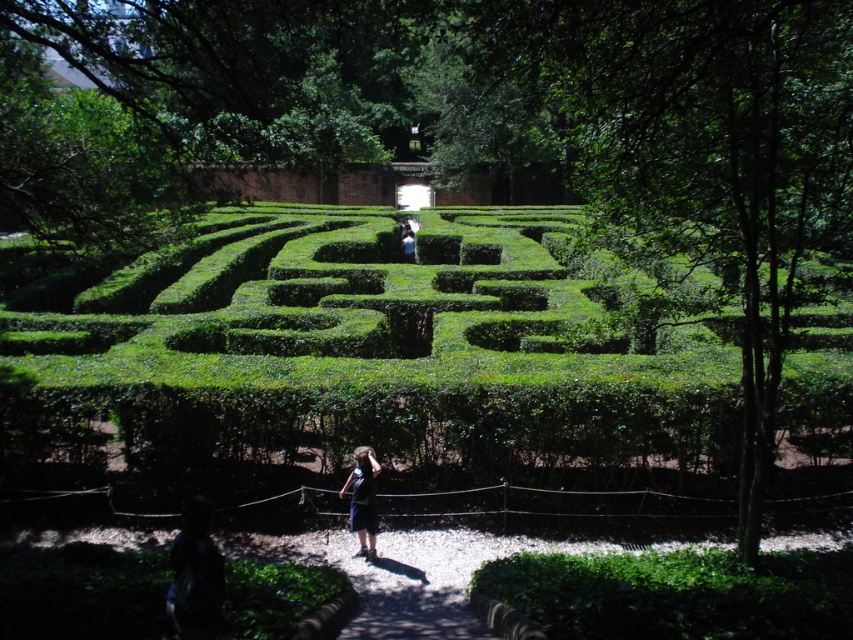
You are a visitor standing at the entrance of the hedge maze and see the dark blue shorts at lower center and the dark blue shirt at center. Which of the two items is positioned higher up in the image?

The dark blue shorts at lower center is much taller than the dark blue shirt at center, so the dark blue shorts at lower center is positioned higher up in the image.

You are standing at the entrance of the hedge maze and see a person wearing dark blue shirt at lower left and dark blue shorts at lower center. Which clothing item is positioned higher relative to the other?

The dark blue shirt at lower left is located above the dark blue shorts at lower center, so the dark blue shirt at lower left is positioned higher.

You are standing at the entrance of the hedge maze and see two people wearing dark blue clothing. The first person is wearing a dark blue shirt at lower left, and the second is wearing dark blue shorts at lower center. If you want to join the person who is closer to the maze entrance, which one should you approach?

The dark blue shirt at lower left is 3.98 meters away from the dark blue shorts at lower center. Since the dark blue shirt at lower left is closer to the entrance than the dark blue shorts at lower center, you should approach the dark blue shirt at lower left.